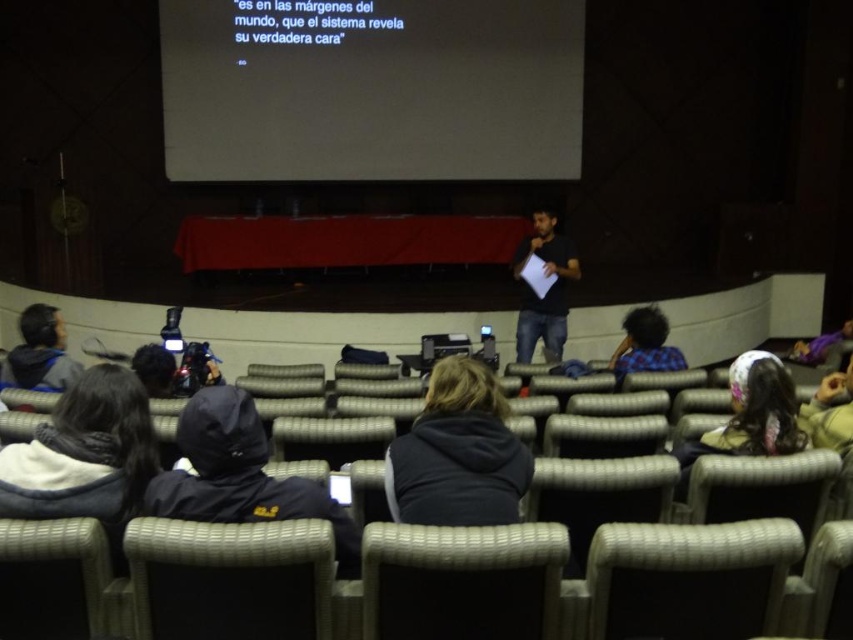
Consider the image. You are a student attending a lecture and you want to sit down. You see a dark blue hooded jacket at lower left and a gray fabric chair at center. Is the jacket covering the chair?

The dark blue hooded jacket at lower left is positioned over gray fabric chair at center, so yes, the jacket is covering the chair.

You are sitting in the front row of the lecture hall and notice two points on the large screen. Which point, point (x=238, y=125) or point (x=258, y=634), is closer to you?

Point (x=238, y=125) is closer to you because it is further to the viewer than point (x=258, y=634).

You are a student sitting in the front row of the lecture hall. You notice a point marked at coordinates (370, 90). Where is this point located in relation to the black matte screen at upper center?

The point marked at coordinates (370, 90) is located on the black matte screen at upper center.